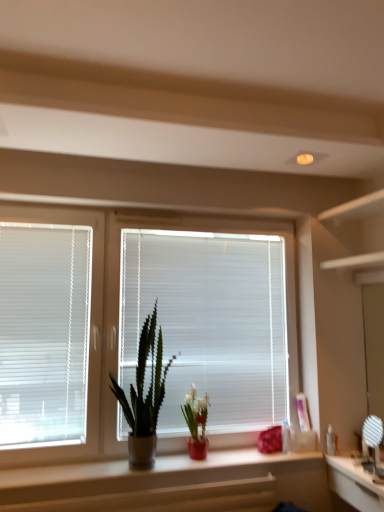
Find the location of a particular element. Image resolution: width=384 pixels, height=512 pixels. free space to the right of clear plastic bottle at right, arranged as the second toiletry when viewed from the left is located at coordinates (350, 455).